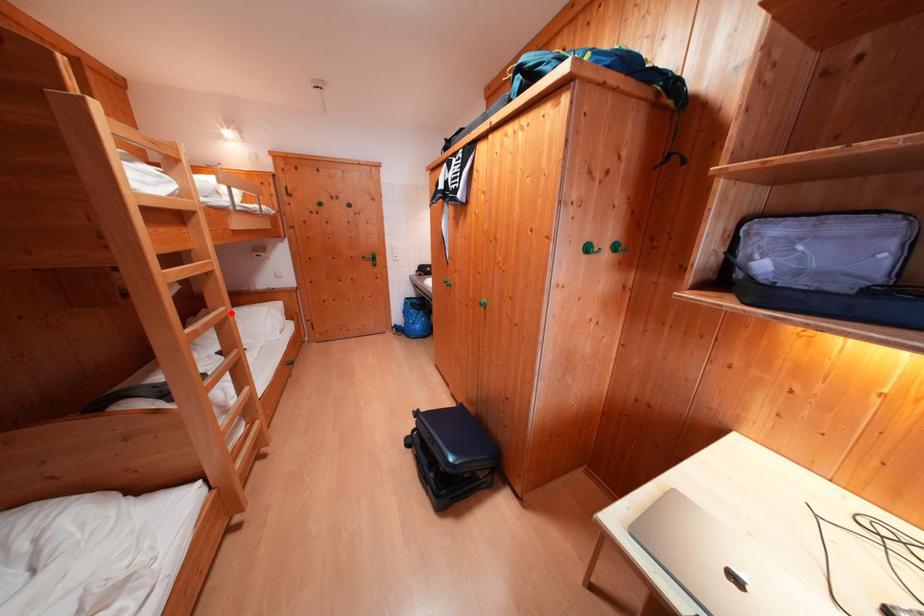
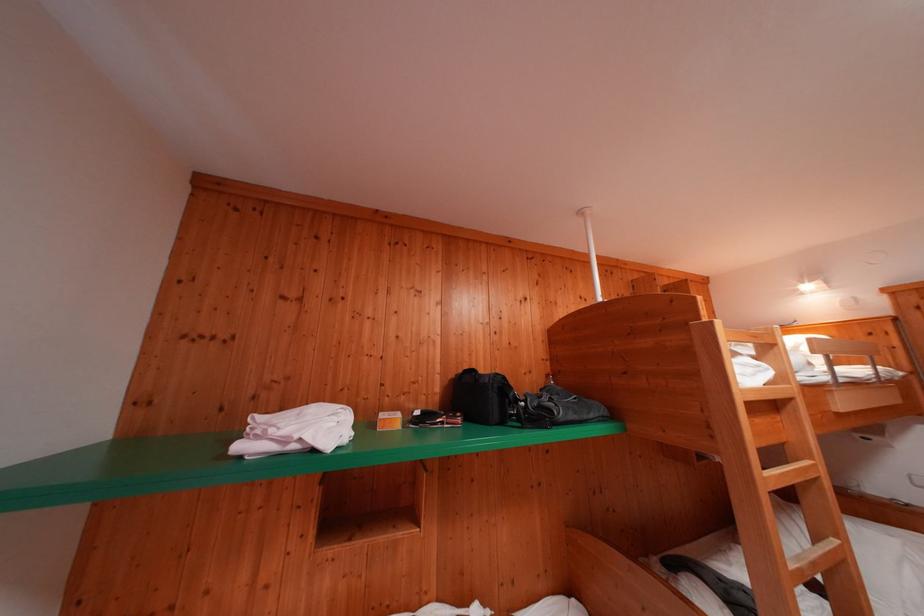
In the second image, find the point that corresponds to the highlighted location in the first image.

(843, 545)